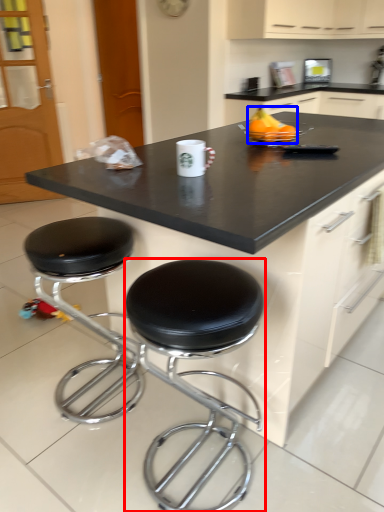
Question: Which object is closer to the camera taking this photo, stool (highlighted by a red box) or fruit (highlighted by a blue box)?

Choices:
 (A) stool
 (B) fruit

Answer: (A)